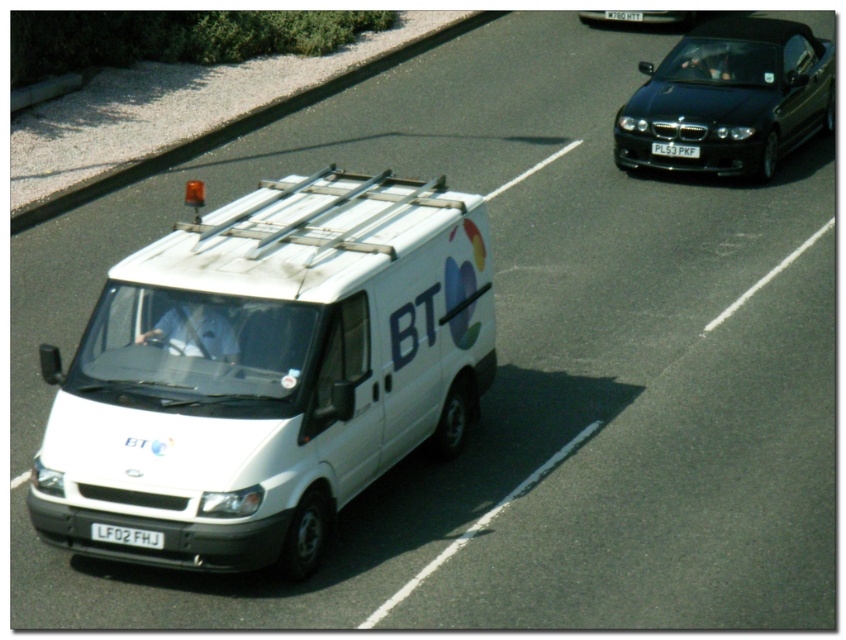
Question: Estimate the real-world distances between objects in this image. Which object is closer to the white matte van at center?

Choices:
 (A) black plastic license plate at center
 (B) white plastic license plate at center
 (C) black glossy car at upper right

Answer: (B)

Question: Is white plastic license plate at lower center positioned behind white plastic license plate at center?

Choices:
 (A) yes
 (B) no

Answer: (B)

Question: Does white plastic license plate at lower center have a lesser width compared to black plastic license plate at center?

Choices:
 (A) yes
 (B) no

Answer: (A)

Question: Can you confirm if white matte van at center is smaller than white plastic license plate at lower center?

Choices:
 (A) yes
 (B) no

Answer: (B)

Question: Which object is closer to the camera taking this photo?

Choices:
 (A) black glossy car at upper right
 (B) white plastic license plate at center
 (C) white plastic license plate at lower center
 (D) black plastic license plate at center

Answer: (C)

Question: Which of the following is the farthest from the observer?

Choices:
 (A) (261, 468)
 (B) (693, 148)

Answer: (B)